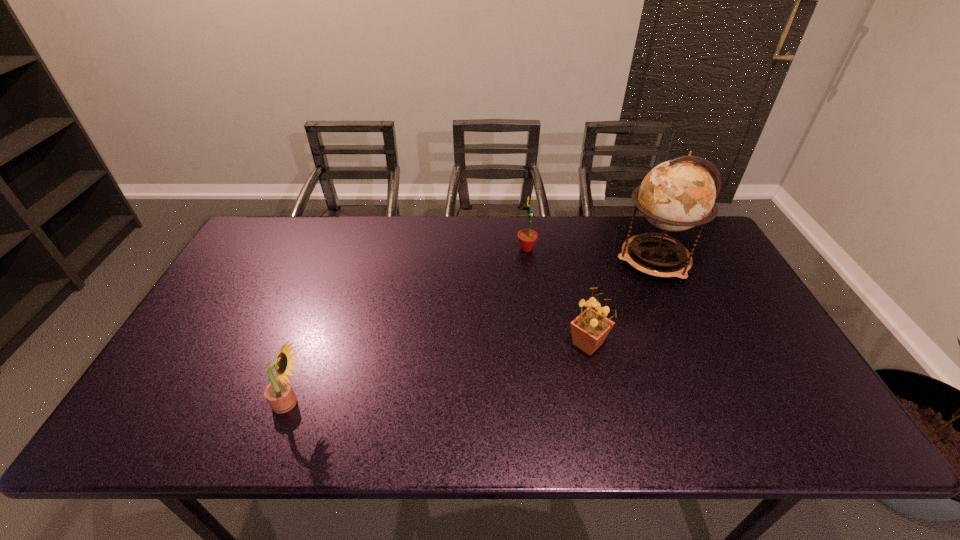
Find the location of a particular element. free spot located 0.190m at the center of the rightmost object is located at coordinates (555, 261).

Find the location of a particular element. This screenshot has height=540, width=960. vacant space located on the face of the second sunflower from right to left is located at coordinates (410, 248).

Find the location of `free spot located 0.210m on the face of the second sunflower from right to left`. free spot located 0.210m on the face of the second sunflower from right to left is located at coordinates (452, 248).

Where is `vacant space located 0.050m on the face of the second sunflower from right to left`? vacant space located 0.050m on the face of the second sunflower from right to left is located at coordinates (501, 248).

Where is `vacant space situated at the front of the second object from right to left with flowers visible`? vacant space situated at the front of the second object from right to left with flowers visible is located at coordinates (605, 419).

Image resolution: width=960 pixels, height=540 pixels. I want to click on vacant region located 0.060m on the face of the leftmost object, so click(333, 403).

You are a GUI agent. You are given a task and a screenshot of the screen. Output one action in this format:
    pyautogui.click(x=<x>, y=<y>)
    Task: Click on the globe at the far edge
    Image resolution: width=960 pixels, height=540 pixels.
    Given the screenshot: What is the action you would take?
    pyautogui.click(x=676, y=195)

Identify the location of sunflower positioned at the far edge. (527, 237).

Image resolution: width=960 pixels, height=540 pixels. Find the location of `object located at the near edge`. object located at the near edge is located at coordinates (279, 393).

Where is `object present at the right edge`? Image resolution: width=960 pixels, height=540 pixels. object present at the right edge is located at coordinates (676, 195).